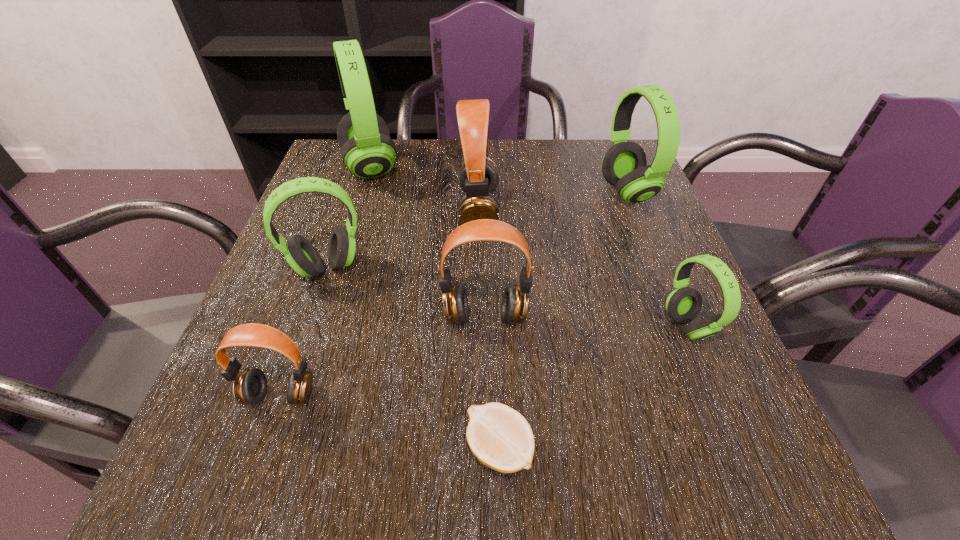
Locate an element on the screen. The image size is (960, 540). the tallest headset is located at coordinates [367, 150].

Locate an element on the screen. Image resolution: width=960 pixels, height=540 pixels. the biggest green headset is located at coordinates (367, 150).

Find the location of `the biggest brown headset`. the biggest brown headset is located at coordinates (478, 178).

The width and height of the screenshot is (960, 540). In order to click on the third smallest green headset in this screenshot , I will do [624, 166].

Where is `the third farthest green headset`? The height and width of the screenshot is (540, 960). the third farthest green headset is located at coordinates (301, 255).

Find the location of a particular element. Image resolution: width=960 pixels, height=540 pixels. the fifth nearest object is located at coordinates (301, 255).

Locate an element on the screen. the second farthest brown headset is located at coordinates (514, 307).

I want to click on the nearest green headset, so click(x=683, y=304).

Identify the location of the seventh farthest object. The width and height of the screenshot is (960, 540). (250, 386).

Image resolution: width=960 pixels, height=540 pixels. I want to click on the smallest brown headset, so click(250, 386).